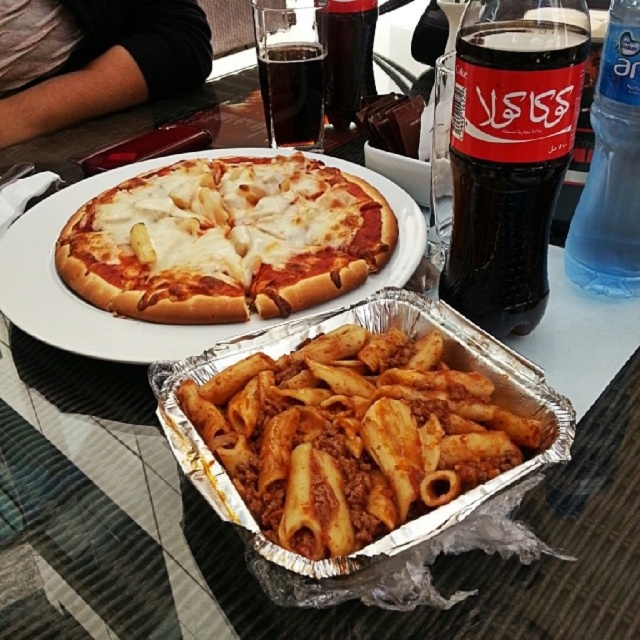
Is matte yellow pasta at center wider than dark glass soda at upper center?

Correct, the width of matte yellow pasta at center exceeds that of dark glass soda at upper center.

Can you confirm if matte yellow pasta at center is positioned to the right of dark glass soda at upper center?

Indeed, matte yellow pasta at center is positioned on the right side of dark glass soda at upper center.

Image resolution: width=640 pixels, height=640 pixels. What do you see at coordinates (352, 435) in the screenshot? I see `matte yellow pasta at center` at bounding box center [352, 435].

The height and width of the screenshot is (640, 640). I want to click on matte yellow pasta at center, so click(352, 435).

Does dark glass coca-cola at upper right appear over blue plastic bottle at upper right?

Actually, dark glass coca-cola at upper right is below blue plastic bottle at upper right.

Is dark glass coca-cola at upper right bigger than blue plastic bottle at upper right?

Yes.

This screenshot has height=640, width=640. Identify the location of dark glass coca-cola at upper right. (509, 154).

You are a GUI agent. You are given a task and a screenshot of the screen. Output one action in this format:
    pyautogui.click(x=<x>, y=<y>)
    Task: Click on the dark glass coca-cola at upper right
    This screenshot has height=640, width=640.
    Given the screenshot: What is the action you would take?
    pyautogui.click(x=509, y=154)

Describe the element at coordinates (225, 240) in the screenshot. I see `white cheese pizza at center` at that location.

Between white cheese pizza at center and gray fabric shirt at upper left, which one appears on the left side from the viewer's perspective?

gray fabric shirt at upper left

You are a GUI agent. You are given a task and a screenshot of the screen. Output one action in this format:
    pyautogui.click(x=<x>, y=<y>)
    Task: Click on the white cheese pizza at center
    This screenshot has width=640, height=640.
    Given the screenshot: What is the action you would take?
    pyautogui.click(x=225, y=240)

This screenshot has height=640, width=640. Find the location of `white cheese pizza at center`. white cheese pizza at center is located at coordinates (225, 240).